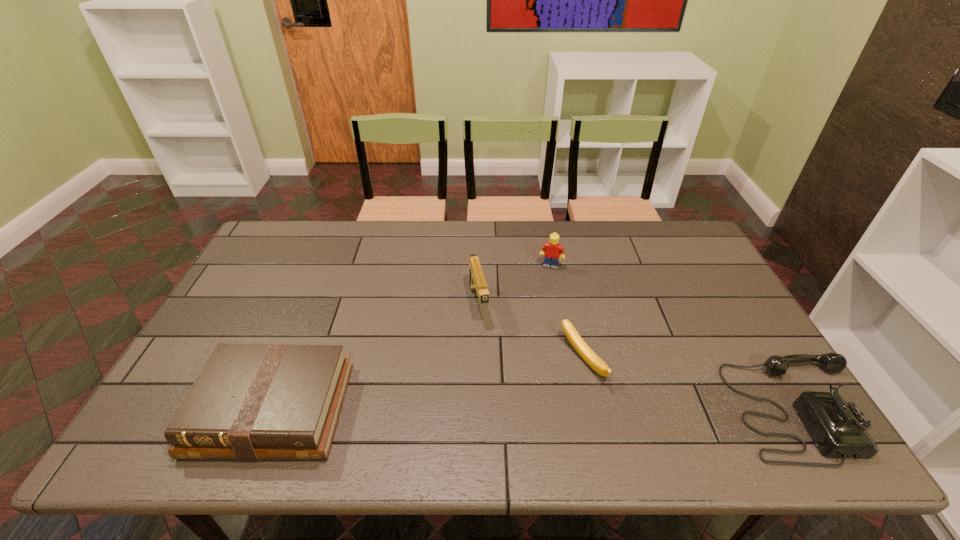
Where is `free region that satisfies the following two spatial constraints: 1. on the spine side of the Bible; 2. on the dial of the telephone`? free region that satisfies the following two spatial constraints: 1. on the spine side of the Bible; 2. on the dial of the telephone is located at coordinates (273, 409).

At what (x,y) coordinates should I click in order to perform the action: click on free space that satisfies the following two spatial constraints: 1. on the spine side of the telephone; 2. on the dial of the Bible. Please return your answer as a coordinate pair (x, y). Looking at the image, I should click on (273, 409).

Locate an element on the screen. This screenshot has width=960, height=540. vacant position in the image that satisfies the following two spatial constraints: 1. on the front side of the rightmost object; 2. on the dial of the Lego is located at coordinates (578, 409).

The width and height of the screenshot is (960, 540). I want to click on free location that satisfies the following two spatial constraints: 1. on the back side of the pistol; 2. on the right side of the Lego, so click(478, 266).